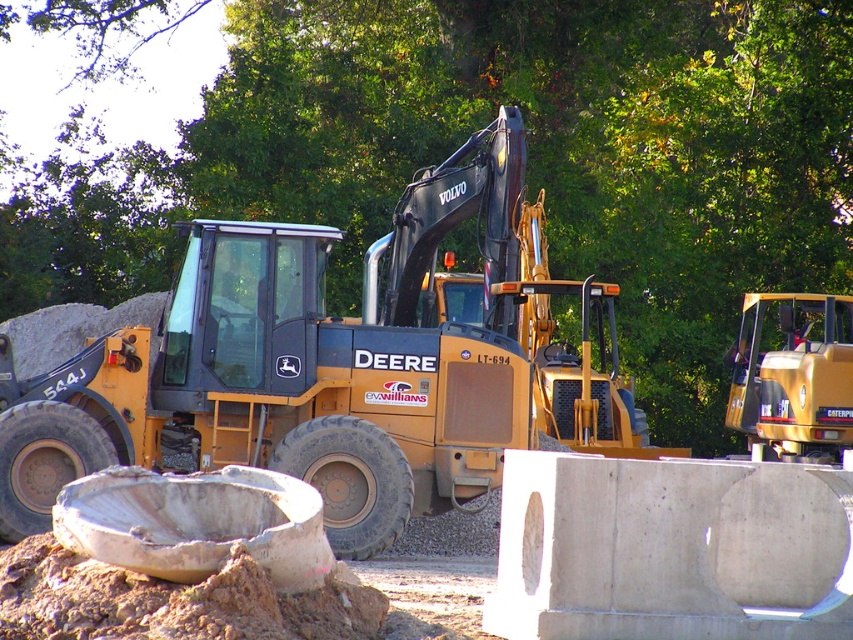
How distant is yellow metallic excavator at center from gray concrete at center?

A distance of 28.81 feet exists between yellow metallic excavator at center and gray concrete at center.

Is yellow metallic excavator at center smaller than gray concrete at center?

Indeed, yellow metallic excavator at center has a smaller size compared to gray concrete at center.

Between point (120, 333) and point (582, 492), which one is positioned in front?

Point (582, 492) is more forward.

Find the location of a particular element. This screenshot has width=853, height=640. yellow metallic excavator at center is located at coordinates (337, 365).

Which of these two, gray concrete at center or yellow metallic tractor at right, stands taller?

gray concrete at center is taller.

Image resolution: width=853 pixels, height=640 pixels. I want to click on gray concrete at center, so click(x=671, y=550).

You are a GUI agent. You are given a task and a screenshot of the screen. Output one action in this format:
    pyautogui.click(x=<x>, y=<y>)
    Task: Click on the gray concrete at center
    
    Given the screenshot: What is the action you would take?
    pyautogui.click(x=671, y=550)

Does brown sandy dirt at lower left appear under yellow metallic tractor at right?

Yes.

Between point (347, 637) and point (750, 348), which one is positioned behind?

Positioned behind is point (750, 348).

Between point (370, 588) and point (817, 426), which one is positioned in front?

Positioned in front is point (370, 588).

Identify the location of brown sandy dirt at lower left. (183, 604).